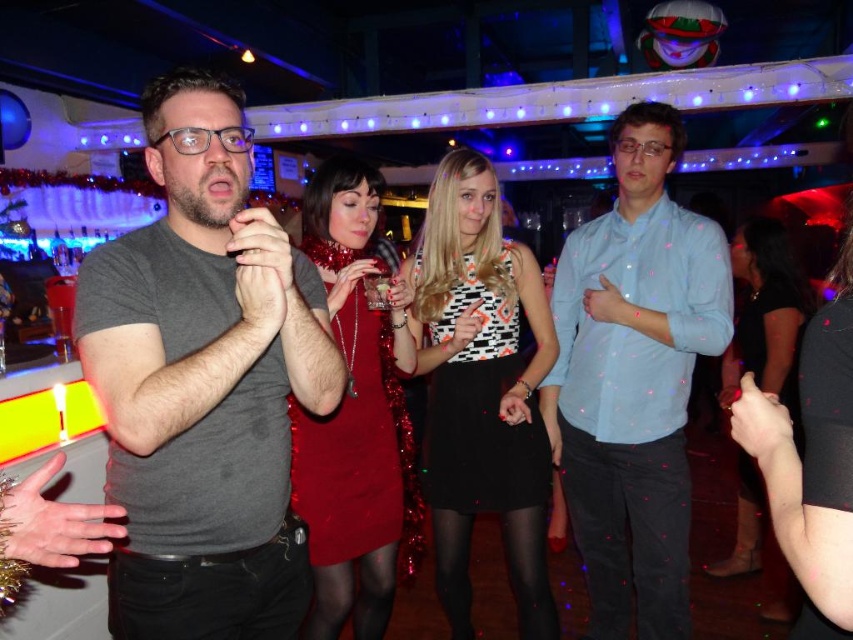
You are a photographer trying to capture the best shot of the party. You notice two points in the scene labeled as point (358, 372) and point (798, 307). If you want to focus on the closer one to the camera, which point should you aim your camera at?

Point (358, 372) is closer to the camera than point (798, 307), so you should aim your camera at point (358, 372) to focus on the closer one.